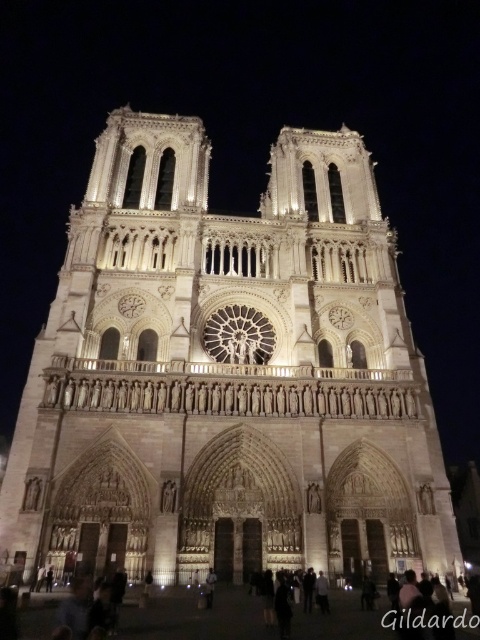
Can you confirm if light beige stone tower at center is shorter than dark skin textured person at lower center?

In fact, light beige stone tower at center may be taller than dark skin textured person at lower center.

Who is more distant from viewer, (70, 568) or (142, 627)?

The point (70, 568) is more distant.

Is point (37, 545) farther from camera compared to point (188, 612)?

Yes, point (37, 545) is farther from viewer.

This screenshot has height=640, width=480. Identify the location of light beige stone tower at center. (227, 376).